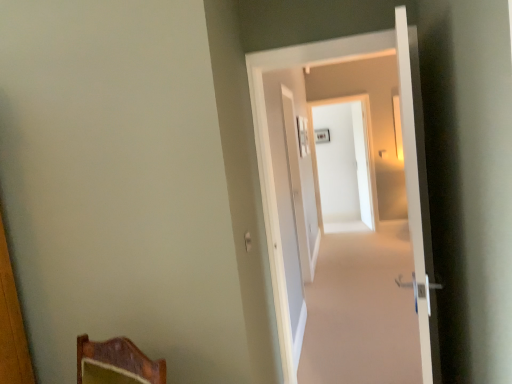
Image resolution: width=512 pixels, height=384 pixels. What do you see at coordinates (301, 184) in the screenshot?
I see `white glossy door at center, arranged as the 2th screen door when viewed from the right` at bounding box center [301, 184].

Describe the element at coordinates (344, 163) in the screenshot. I see `white glossy screen door at center, which ranks as the first screen door in right-to-left order` at that location.

Locate an element on the screen. The height and width of the screenshot is (384, 512). white glossy door at center, marked as the 1th screen door in a front-to-back arrangement is located at coordinates (301, 184).

How distant is white glossy door at center, acting as the second door starting from the front, from white glossy door at right, marked as the second door in a back-to-front arrangement?

They are 37.32 centimeters apart.

Which of these two, white glossy door at center, placed as the first door when sorted from back to front, or white glossy door at right, the first door in the front-to-back sequence, is bigger?

white glossy door at right, the first door in the front-to-back sequence.

In the scene shown: Is white glossy door at right, marked as the second door in a back-to-front arrangement, at the back of white glossy door at center, acting as the second door starting from the front?

No.

Is white glossy door at center, acting as the second door starting from the front, far away from white glossy door at right, marked as the second door in a back-to-front arrangement?

No, white glossy door at center, acting as the second door starting from the front, is not far from white glossy door at right, marked as the second door in a back-to-front arrangement.

Considering the sizes of objects white glossy door at right, marked as the second door in a back-to-front arrangement, and white glossy door at center, placed as the first door when sorted from back to front, in the image provided, who is taller, white glossy door at right, marked as the second door in a back-to-front arrangement, or white glossy door at center, placed as the first door when sorted from back to front,?

white glossy door at center, placed as the first door when sorted from back to front, is taller.

Consider the image. Can we say white glossy door at right, marked as the second door in a back-to-front arrangement, lies outside white glossy door at center, acting as the second door starting from the front?

Indeed, white glossy door at right, marked as the second door in a back-to-front arrangement, is completely outside white glossy door at center, acting as the second door starting from the front.

From a real-world perspective, between white glossy door at right, marked as the second door in a back-to-front arrangement, and white glossy door at center, acting as the second door starting from the front, who is vertically lower?

white glossy door at center, acting as the second door starting from the front.

From the image's perspective, is white glossy door at right, marked as the second door in a back-to-front arrangement, positioned above or below white glossy door at center, acting as the second door starting from the front?

From the image's perspective, white glossy door at right, marked as the second door in a back-to-front arrangement, appears below white glossy door at center, acting as the second door starting from the front.

Does white glossy door at center, the 2th screen door in the back-to-front sequence, have a greater width compared to white glossy door at center, placed as the first door when sorted from back to front?

Incorrect, the width of white glossy door at center, the 2th screen door in the back-to-front sequence, does not surpass that of white glossy door at center, placed as the first door when sorted from back to front.

Based on their sizes in the image, would you say white glossy door at center, the 2th screen door in the back-to-front sequence, is bigger or smaller than white glossy door at center, acting as the second door starting from the front?

white glossy door at center, the 2th screen door in the back-to-front sequence, is bigger than white glossy door at center, acting as the second door starting from the front.

Are white glossy door at center, arranged as the 2th screen door when viewed from the right, and white glossy door at center, placed as the first door when sorted from back to front, located far from each other?

Yes, white glossy door at center, arranged as the 2th screen door when viewed from the right, is far from white glossy door at center, placed as the first door when sorted from back to front.

From the image's perspective, is white glossy door at center, acting as the second door starting from the front, above white glossy screen door at center, the 2th screen door viewed from the front?

Incorrect, from the image's perspective, white glossy door at center, acting as the second door starting from the front, is lower than white glossy screen door at center, the 2th screen door viewed from the front.

Is white glossy screen door at center, acting as the second screen door starting from the left, surrounded by white glossy door at center, placed as the first door when sorted from back to front?

Actually, white glossy screen door at center, acting as the second screen door starting from the left, is outside white glossy door at center, placed as the first door when sorted from back to front.

Considering the positions of objects white glossy door at center, placed as the first door when sorted from back to front, and white glossy screen door at center, the 1th screen door when ordered from back to front, in the image provided, who is more to the left, white glossy door at center, placed as the first door when sorted from back to front, or white glossy screen door at center, the 1th screen door when ordered from back to front,?

white glossy door at center, placed as the first door when sorted from back to front.

Measure the distance between white glossy door at right, marked as the second door in a back-to-front arrangement, and white glossy screen door at center, acting as the second screen door starting from the left.

white glossy door at right, marked as the second door in a back-to-front arrangement, and white glossy screen door at center, acting as the second screen door starting from the left, are 4.41 meters apart from each other.

From the white glossy screen door at center, acting as the second screen door starting from the left, count 2nd doors forward and point to it. Please provide its 2D coordinates.

[(417, 192)]

From the image's perspective, is white glossy door at right, the first door in the front-to-back sequence, located above white glossy screen door at center, acting as the second screen door starting from the left?

No, from the image's perspective, white glossy door at right, the first door in the front-to-back sequence, is not on top of white glossy screen door at center, acting as the second screen door starting from the left.

How many degrees apart are the facing directions of white glossy door at right, marked as the second door in a back-to-front arrangement, and white glossy screen door at center, the 2th screen door viewed from the front?

95.9 degrees separate the facing orientations of white glossy door at right, marked as the second door in a back-to-front arrangement, and white glossy screen door at center, the 2th screen door viewed from the front.

Find the location of `door that is the 1st object located below the white glossy screen door at center, the 1th screen door when ordered from back to front (from the image's perspective)`. door that is the 1st object located below the white glossy screen door at center, the 1th screen door when ordered from back to front (from the image's perspective) is located at coordinates coord(286,163).

From the picture: Does white glossy screen door at center, the 1th screen door when ordered from back to front, have a larger size compared to white glossy door at center, acting as the second door starting from the front?

Actually, white glossy screen door at center, the 1th screen door when ordered from back to front, might be smaller than white glossy door at center, acting as the second door starting from the front.

Would you consider white glossy screen door at center, the 1th screen door when ordered from back to front, to be distant from white glossy door at center, placed as the first door when sorted from back to front?

Absolutely, white glossy screen door at center, the 1th screen door when ordered from back to front, is distant from white glossy door at center, placed as the first door when sorted from back to front.

Can you tell me how much white glossy door at center, arranged as the 2th screen door when viewed from the right, and white glossy door at right, the first door in the front-to-back sequence, differ in facing direction?

175 degrees separate the facing orientations of white glossy door at center, arranged as the 2th screen door when viewed from the right, and white glossy door at right, the first door in the front-to-back sequence.

From the picture: Is white glossy door at center, the 2th screen door in the back-to-front sequence, further to the viewer compared to white glossy door at right, the first door in the front-to-back sequence?

Yes, it is.

Which object is thinner, white glossy door at center, positioned as the first screen door in left-to-right order, or white glossy door at right, marked as the second door in a back-to-front arrangement?

Thinner between the two is white glossy door at center, positioned as the first screen door in left-to-right order.

Considering the sizes of white glossy door at center, arranged as the 2th screen door when viewed from the right, and white glossy door at right, the first door in the front-to-back sequence, in the image, is white glossy door at center, arranged as the 2th screen door when viewed from the right, bigger or smaller than white glossy door at right, the first door in the front-to-back sequence,?

In the image, white glossy door at center, arranged as the 2th screen door when viewed from the right, appears to be smaller than white glossy door at right, the first door in the front-to-back sequence.

Where is `door below the white glossy door at right, marked as the second door in a back-to-front arrangement (from a real-world perspective)`? This screenshot has height=384, width=512. door below the white glossy door at right, marked as the second door in a back-to-front arrangement (from a real-world perspective) is located at coordinates (286, 163).

What are the coordinates of `door above the white glossy door at center, acting as the second door starting from the front (from a real-world perspective)` in the screenshot? It's located at (417, 192).

Looking at the image, which one is located closer to white glossy door at center, arranged as the 2th screen door when viewed from the right, white glossy door at center, placed as the first door when sorted from back to front, or white glossy screen door at center, which ranks as the first screen door in right-to-left order?

white glossy door at center, placed as the first door when sorted from back to front, is positioned closer to the anchor white glossy door at center, arranged as the 2th screen door when viewed from the right.

Considering their positions, is white glossy screen door at center, the 2th screen door viewed from the front, positioned closer to white glossy door at center, arranged as the 2th screen door when viewed from the right, than white glossy door at right, the first door in the front-to-back sequence?

white glossy screen door at center, the 2th screen door viewed from the front, lies closer to white glossy door at center, arranged as the 2th screen door when viewed from the right, than the other object.

Looking at the image, which one is located further to white glossy screen door at center, the 1th screen door when ordered from back to front, white glossy door at center, marked as the 1th screen door in a front-to-back arrangement, or white glossy door at right, the first door in the front-to-back sequence?

white glossy door at right, the first door in the front-to-back sequence.

Considering their positions, is white glossy door at center, placed as the first door when sorted from back to front, positioned closer to white glossy door at right, the first door in the front-to-back sequence, than white glossy door at center, marked as the 1th screen door in a front-to-back arrangement?

white glossy door at center, placed as the first door when sorted from back to front, lies closer to white glossy door at right, the first door in the front-to-back sequence, than the other object.

When comparing their distances from white glossy screen door at center, the 2th screen door viewed from the front, does white glossy door at center, acting as the second door starting from the front, or white glossy door at center, the 2th screen door in the back-to-front sequence, seem further?

white glossy door at center, acting as the second door starting from the front, is positioned further to the anchor white glossy screen door at center, the 2th screen door viewed from the front.

When comparing their distances from white glossy screen door at center, the 1th screen door when ordered from back to front, does white glossy door at center, placed as the first door when sorted from back to front, or white glossy door at right, the first door in the front-to-back sequence, seem closer?

white glossy door at center, placed as the first door when sorted from back to front, is positioned closer to the anchor white glossy screen door at center, the 1th screen door when ordered from back to front.

When comparing their distances from white glossy door at center, acting as the second door starting from the front, does white glossy door at center, arranged as the 2th screen door when viewed from the right, or white glossy screen door at center, which ranks as the first screen door in right-to-left order, seem closer?

white glossy door at center, arranged as the 2th screen door when viewed from the right, lies closer to white glossy door at center, acting as the second door starting from the front, than the other object.

Looking at the image, which one is located closer to white glossy door at center, placed as the first door when sorted from back to front, white glossy screen door at center, the 1th screen door when ordered from back to front, or white glossy door at center, the 2th screen door in the back-to-front sequence?

Based on the image, white glossy door at center, the 2th screen door in the back-to-front sequence, appears to be nearer to white glossy door at center, placed as the first door when sorted from back to front.

Where is `screen door between white glossy door at right, the first door in the front-to-back sequence, and white glossy screen door at center, the 1th screen door when ordered from back to front, from front to back`? screen door between white glossy door at right, the first door in the front-to-back sequence, and white glossy screen door at center, the 1th screen door when ordered from back to front, from front to back is located at coordinates (301, 184).

This screenshot has height=384, width=512. In order to click on screen door between white glossy door at center, placed as the first door when sorted from back to front, and white glossy screen door at center, acting as the second screen door starting from the left, along the z-axis in this screenshot , I will do `click(301, 184)`.

Find the location of `door positioned between white glossy door at right, the first door in the front-to-back sequence, and white glossy screen door at center, which ranks as the first screen door in right-to-left order, from near to far`. door positioned between white glossy door at right, the first door in the front-to-back sequence, and white glossy screen door at center, which ranks as the first screen door in right-to-left order, from near to far is located at coordinates (286, 163).

Find the location of `door between white glossy door at right, the first door in the front-to-back sequence, and white glossy door at center, marked as the 1th screen door in a front-to-back arrangement, in the front-back direction`. door between white glossy door at right, the first door in the front-to-back sequence, and white glossy door at center, marked as the 1th screen door in a front-to-back arrangement, in the front-back direction is located at coordinates (286, 163).